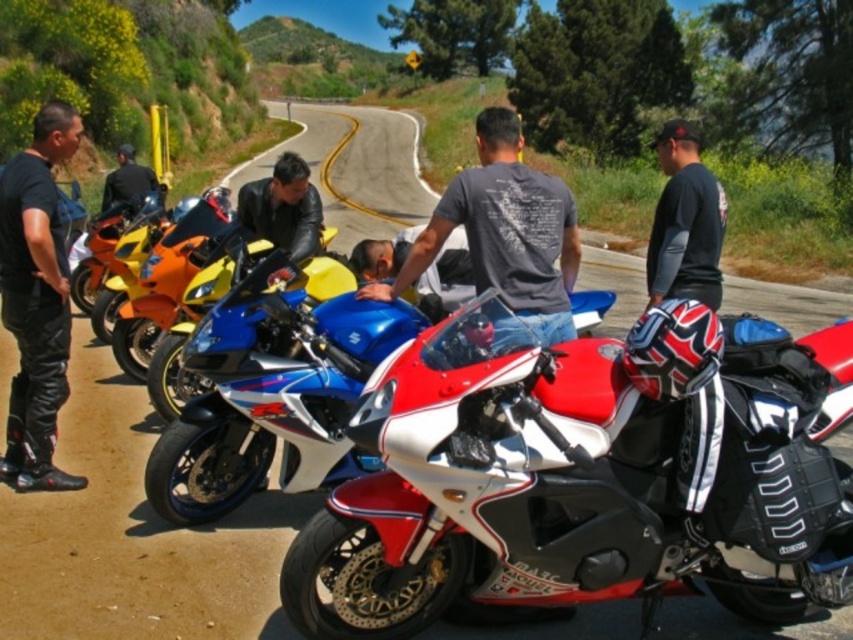
Is the position of gray cotton t-shirt at center less distant than that of black leather jacket at right?

Yes, gray cotton t-shirt at center is closer to the viewer.

Is gray cotton t-shirt at center thinner than black leather jacket at right?

Indeed, gray cotton t-shirt at center has a lesser width compared to black leather jacket at right.

This screenshot has height=640, width=853. Identify the location of gray cotton t-shirt at center. (503, 230).

Can you confirm if gray cotton t-shirt at center is positioned to the left of leather jacket at center?

In fact, gray cotton t-shirt at center is to the right of leather jacket at center.

Is point (523, 314) in front of point (271, 184)?

That is True.

I want to click on gray cotton t-shirt at center, so click(x=503, y=230).

In the scene shown: Is shiny white and red motorcycle at center thinner than blue metallic motorcycle at center?

No, shiny white and red motorcycle at center is not thinner than blue metallic motorcycle at center.

Who is taller, shiny white and red motorcycle at center or blue metallic motorcycle at center?

With more height is shiny white and red motorcycle at center.

Locate an element on the screen. shiny white and red motorcycle at center is located at coordinates (277, 413).